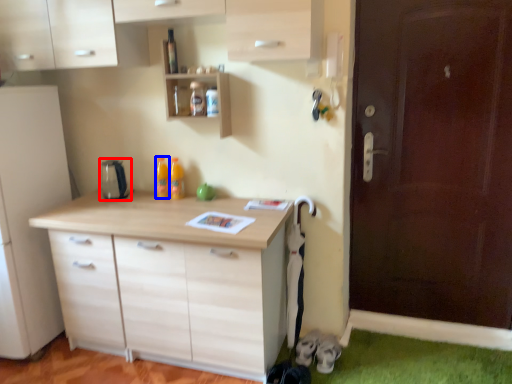
Question: Which object is closer to the camera taking this photo, appliance (highlighted by a red box) or bottle (highlighted by a blue box)?

Choices:
 (A) appliance
 (B) bottle

Answer: (A)